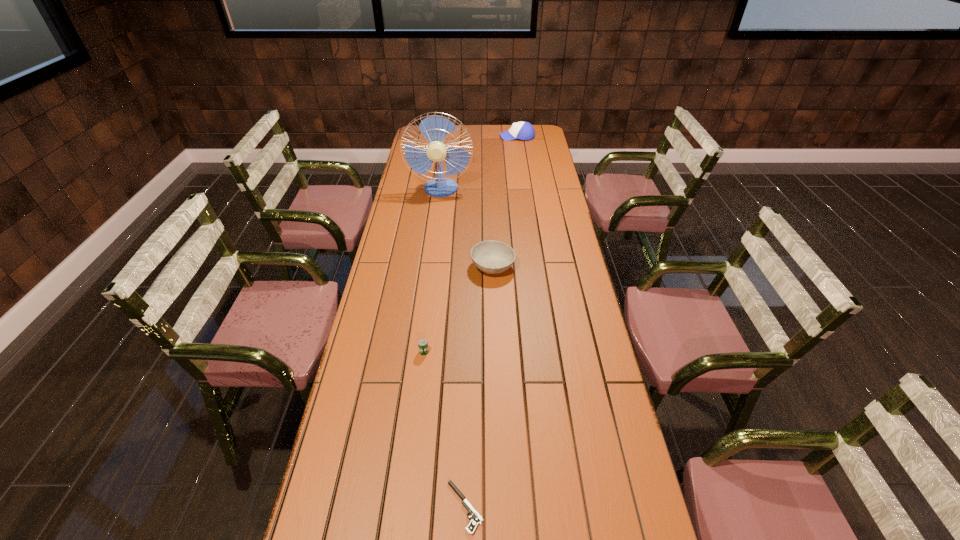
Where is `free space located at the front of the fourth nearest object where the blades are visible`? The height and width of the screenshot is (540, 960). free space located at the front of the fourth nearest object where the blades are visible is located at coordinates (436, 230).

You are a GUI agent. You are given a task and a screenshot of the screen. Output one action in this format:
    pyautogui.click(x=<x>, y=<y>)
    Task: Click on the vacant space located on the front-facing side of the farthest object
    
    Given the screenshot: What is the action you would take?
    pyautogui.click(x=489, y=137)

Image resolution: width=960 pixels, height=540 pixels. In order to click on vacant space located on the front-facing side of the farthest object in this screenshot , I will do `click(444, 137)`.

Find the location of a particular element. The height and width of the screenshot is (540, 960). vacant space located 0.380m on the front-facing side of the farthest object is located at coordinates (431, 137).

Identify the location of vacant region located on the left of the third tallest object. The height and width of the screenshot is (540, 960). (452, 267).

This screenshot has width=960, height=540. In order to click on vacant space located on the right of the fourth tallest object in this screenshot , I will do `click(448, 352)`.

Find the location of a particular element. Image resolution: width=960 pixels, height=540 pixels. free space located on the front-facing side of the nearest object is located at coordinates (319, 507).

The image size is (960, 540). In order to click on vacant space situated on the front-facing side of the nearest object in this screenshot , I will do `click(363, 507)`.

Find the location of a particular element. free location located on the front-facing side of the nearest object is located at coordinates (407, 507).

You are a GUI agent. You are given a task and a screenshot of the screen. Output one action in this format:
    pyautogui.click(x=<x>, y=<y>)
    Task: Click on the object positioned at the far edge
    
    Given the screenshot: What is the action you would take?
    pyautogui.click(x=522, y=130)